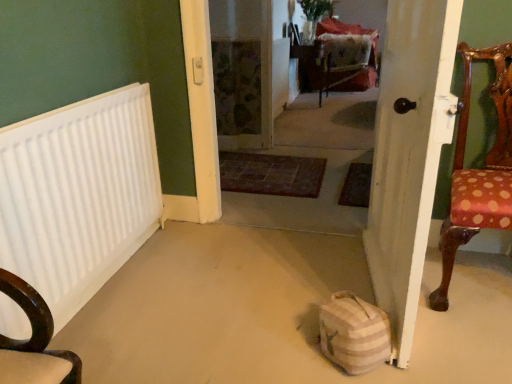
Question: From the image's perspective, is velvet red armchair at center positioned above or below striped fabric bag at lower center?

Choices:
 (A) above
 (B) below

Answer: (A)

Question: In terms of width, does velvet red armchair at center look wider or thinner when compared to striped fabric bag at lower center?

Choices:
 (A) wide
 (B) thin

Answer: (A)

Question: Which object is the farthest from the velvet red armchair at center?

Choices:
 (A) white matte radiator at left
 (B) striped fabric bag at lower center
 (C) polka dot fabric chair at right
 (D) white wooden door at right
 (E) carpeted floor at center

Answer: (B)

Question: Estimate the real-world distances between objects in this image. Which object is closer to the polka dot fabric chair at right?

Choices:
 (A) striped fabric bag at lower center
 (B) carpeted floor at center
 (C) white matte radiator at left
 (D) white wooden door at right
 (E) velvet red armchair at center

Answer: (D)